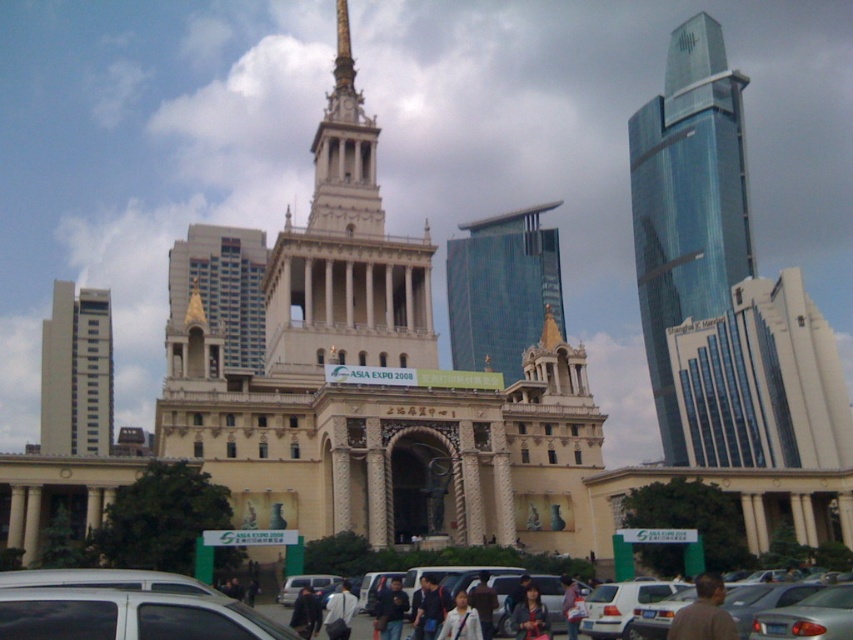
You are a photographer taking a picture of the ASIA EXPO 2008 building. You notice two people in the foreground wearing dark blue jeans at center and white shirt at center. From your perspective, which clothing item is positioned lower in the image?

The dark blue jeans at center is below the white shirt at center, so the dark blue jeans at center is positioned lower in the image.

You are a city planner assessing the space between the shiny glass skyscraper at right and the white smooth tower at left. If you need to install a temporary walkway that is 70 meters long between them, will it fit without needing to extend the walkway?

The distance between the shiny glass skyscraper at right and the white smooth tower at left is 69.71 meters. Since the walkway is 70 meters long, it is slightly longer than the distance between them. Therefore, the walkway would need to be shortened or adjusted to fit the 69.71 meter gap.